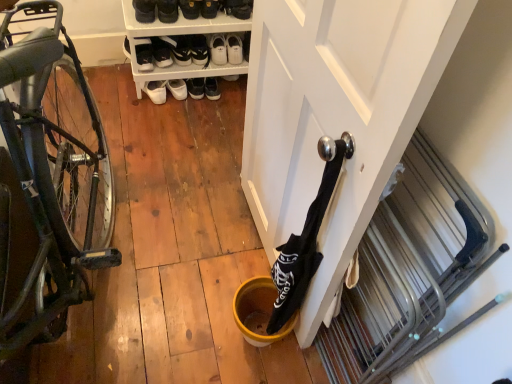
You are a GUI agent. You are given a task and a screenshot of the screen. Output one action in this format:
    pyautogui.click(x=<x>, y=<y>)
    Task: Click on the free location in front of white matte door at center
    
    Given the screenshot: What is the action you would take?
    pyautogui.click(x=203, y=332)